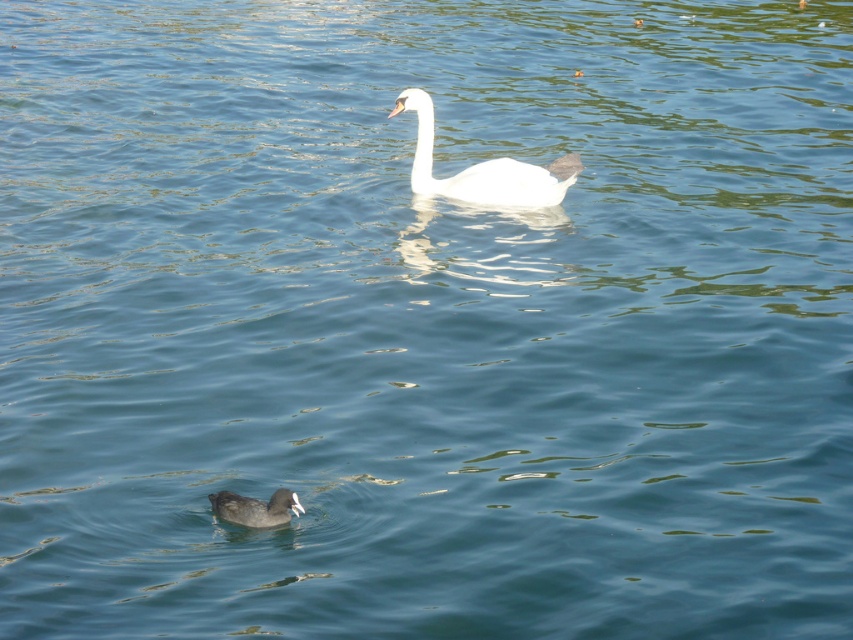
You are a photographer trying to capture both the white glossy swan at upper center and the dark brown matte duck at lower left in a single shot. Based on their positions, which bird will appear larger in the photo?

The white glossy swan at upper center will appear larger in the photo because it is closer to the viewer than the dark brown matte duck at lower left.

You are standing at the edge of the water and see two points on the water surface. The first point is at coordinate point(x=497, y=202) and the second is at point(x=283, y=499). Which point is farther away from you?

Point(x=497, y=202) is behind point(x=283, y=499), so the first point is farther away from you.

You are a wildlife photographer trying to capture a photo of both the white glossy swan at upper center and the dark brown matte duck at lower left in the same frame. Based on their current positions, can you fit both subjects into your camera viewfinder that has a 5 meter maximum distance coverage between the closest and farthest points? Explain your reasoning.

The distance between the white glossy swan at upper center and the dark brown matte duck at lower left is 4.69 meters. Since the camera viewfinder can cover up to 5 meters between the closest and farthest points, both subjects can be included in the same frame as 4.69 meters is less than 5 meters.